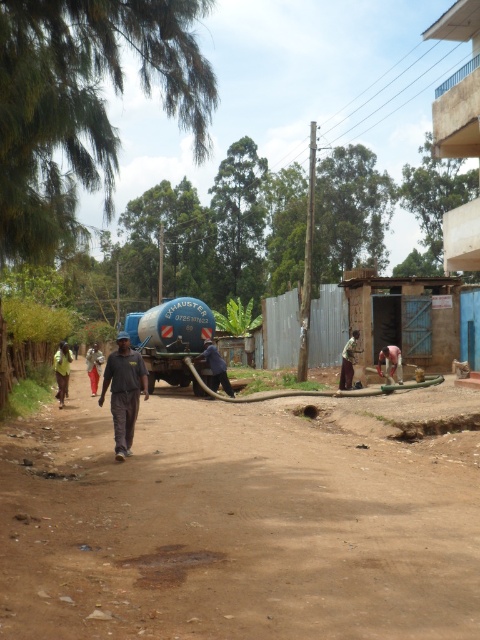
Question: Is brown dirt field at center in front of dark gray fabric at center?

Choices:
 (A) yes
 (B) no

Answer: (A)

Question: Among these objects, which one is nearest to the camera?

Choices:
 (A) brown dirt field at center
 (B) dark gray fabric pants at center

Answer: (A)

Question: Does blue corrugated metal hut at upper right lie behind dark gray fabric pants at center?

Choices:
 (A) no
 (B) yes

Answer: (A)

Question: Can you confirm if dark gray fabric at center is positioned to the left of dark blue fabric at center?

Choices:
 (A) yes
 (B) no

Answer: (A)

Question: Which of the following is the closest to the observer?

Choices:
 (A) light brown skin at lower right
 (B) dark blue fabric at center
 (C) dark gray fabric at center
 (D) light brown fabric shirt at lower right

Answer: (C)

Question: Which object is positioned farthest from the dark gray fabric at center?

Choices:
 (A) brown dirt field at center
 (B) yellow fabric at left
 (C) dark blue fabric at center

Answer: (B)